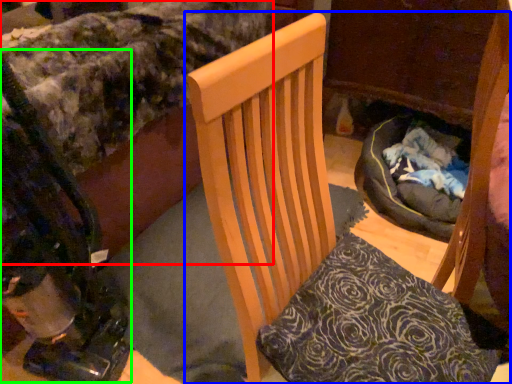
Question: Which object is the closest to the bed (highlighted by a red box)? Choose among these: chair (highlighted by a blue box) or baby carriage (highlighted by a green box).

Choices:
 (A) chair
 (B) baby carriage

Answer: (B)